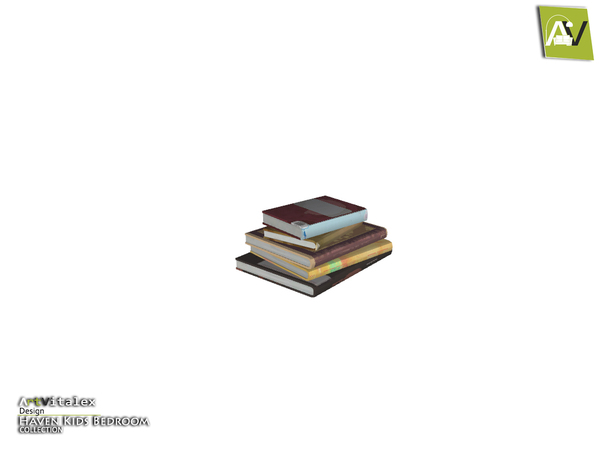
At what (x,y) coordinates should I click in order to perform the action: click on yellow book. Please return your answer as a coordinate pair (x, y). Looking at the image, I should click on pyautogui.click(x=376, y=247).